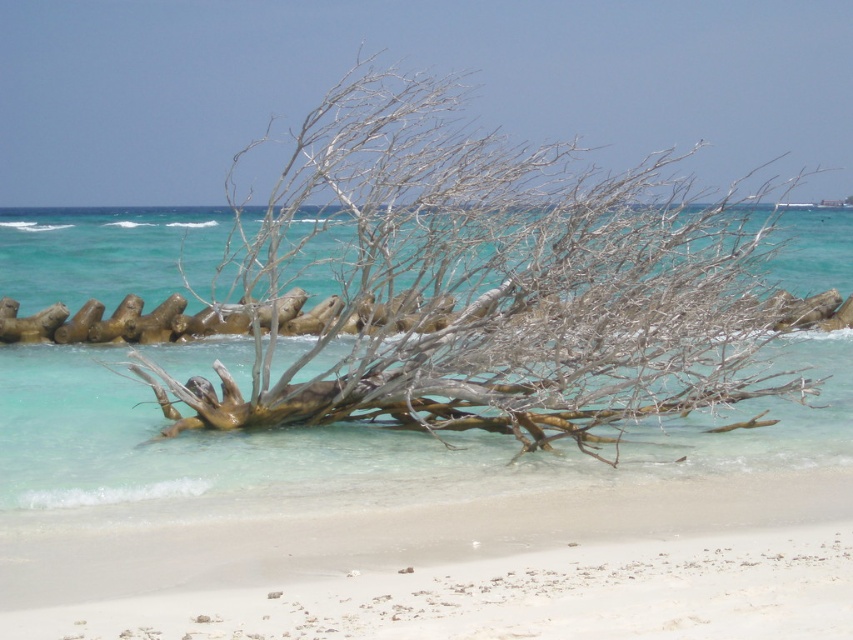
Question: Is gray wood tree at center thinner than white sandy beach at lower center?

Choices:
 (A) no
 (B) yes

Answer: (A)

Question: Is gray wood tree at center thinner than white sandy beach at lower center?

Choices:
 (A) no
 (B) yes

Answer: (A)

Question: Which point is closer to the camera?

Choices:
 (A) (286, 189)
 (B) (729, 529)

Answer: (B)

Question: Which point is closer to the camera?

Choices:
 (A) click(x=328, y=541)
 (B) click(x=479, y=170)

Answer: (A)

Question: Is gray wood tree at center wider than white sandy beach at lower center?

Choices:
 (A) no
 (B) yes

Answer: (B)